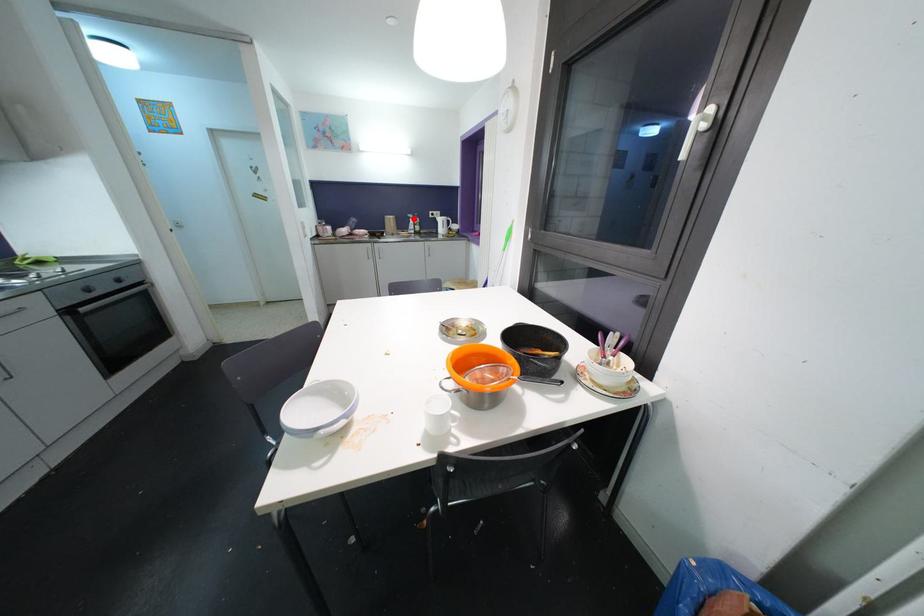
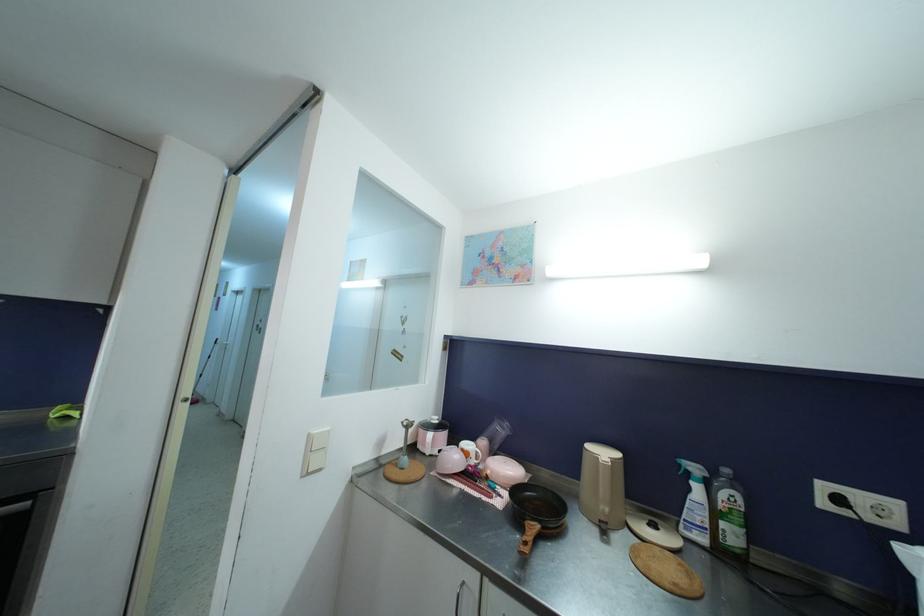
Question: I am providing you with two images of the same scene from different viewpoints. A red point is marked on the first image. Is the red point's position out of view in image 2?

Choices:
 (A) Yes
 (B) No

Answer: (B)